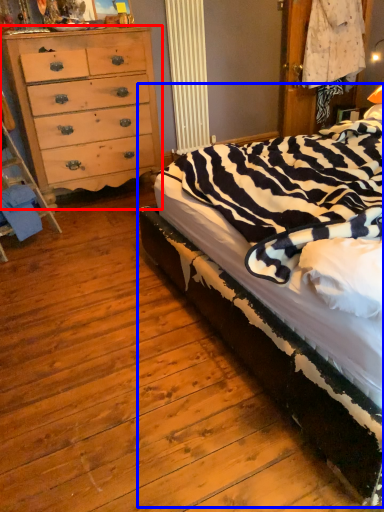
Question: Which object is further to the camera taking this photo, chest of drawers (highlighted by a red box) or bed (highlighted by a blue box)?

Choices:
 (A) chest of drawers
 (B) bed

Answer: (A)